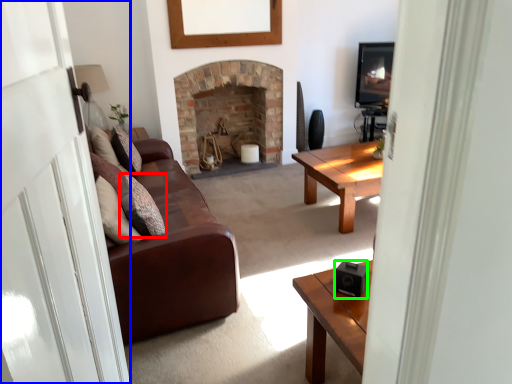
Question: Which is farther away from pillow (highlighted by a red box)? glass door (highlighted by a blue box) or speaker (highlighted by a green box)?

Choices:
 (A) glass door
 (B) speaker

Answer: (B)